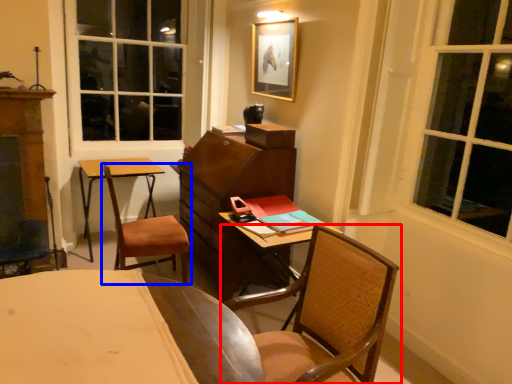
Question: Which object is further to the camera taking this photo, chair (highlighted by a red box) or chair (highlighted by a blue box)?

Choices:
 (A) chair
 (B) chair

Answer: (B)